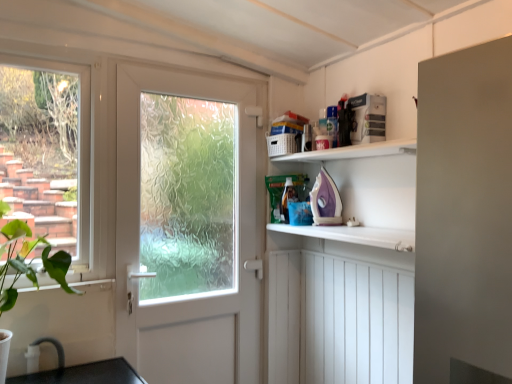
Question: Considering the positions of green leafy plant at lower left and white frosted glass door at center in the image, is green leafy plant at lower left taller or shorter than white frosted glass door at center?

Choices:
 (A) tall
 (B) short

Answer: (B)

Question: Relative to white frosted glass door at center, is green leafy plant at lower left in front or behind?

Choices:
 (A) front
 (B) behind

Answer: (A)

Question: Estimate the real-world distances between objects in this image. Which object is closer to the white frosted glass door at center?

Choices:
 (A) clear glass window at left
 (B) green leafy plant at lower left

Answer: (A)

Question: Estimate the real-world distances between objects in this image. Which object is closer to the clear glass window at left?

Choices:
 (A) green leafy plant at lower left
 (B) white frosted glass door at center

Answer: (A)